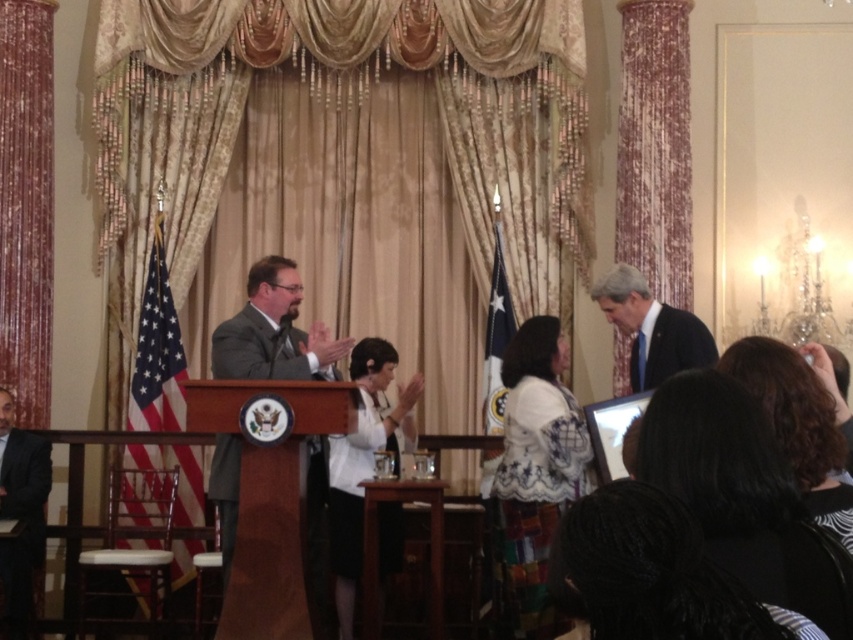
Is gray suit at center taller than white matte blazer at center?

No.

Between gray suit at center and white matte blazer at center, which one appears on the left side from the viewer's perspective?

Positioned to the left is gray suit at center.

Where is `gray suit at center`? gray suit at center is located at coordinates (274, 332).

Can you confirm if black suit at lower left is positioned to the right of blue silk suit at right?

No, black suit at lower left is not to the right of blue silk suit at right.

Does point (6, 481) come farther from viewer compared to point (677, 353)?

Yes, point (6, 481) is farther from viewer.

I want to click on black suit at lower left, so click(20, 513).

Which is below, gray suit at center or black suit at lower left?

black suit at lower left

Between point (238, 344) and point (16, 614), which one is positioned in front?

Positioned in front is point (238, 344).

I want to click on gray suit at center, so click(274, 332).